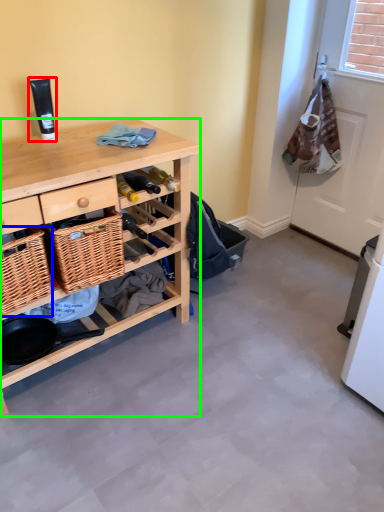
Question: Based on their relative distances, which object is farther from toiletry (highlighted by a red box)? Choose from picnic basket (highlighted by a blue box) and desk (highlighted by a green box).

Choices:
 (A) picnic basket
 (B) desk

Answer: (A)